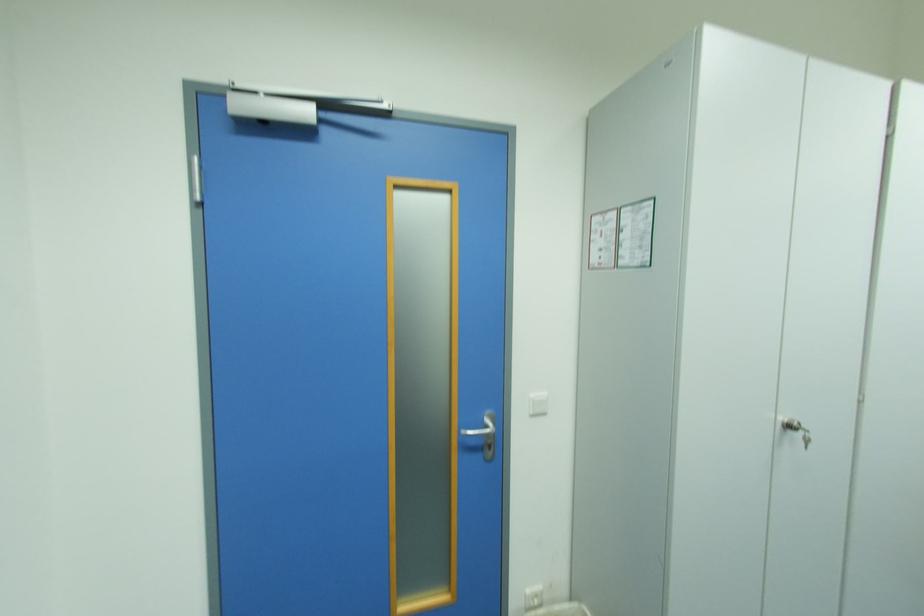
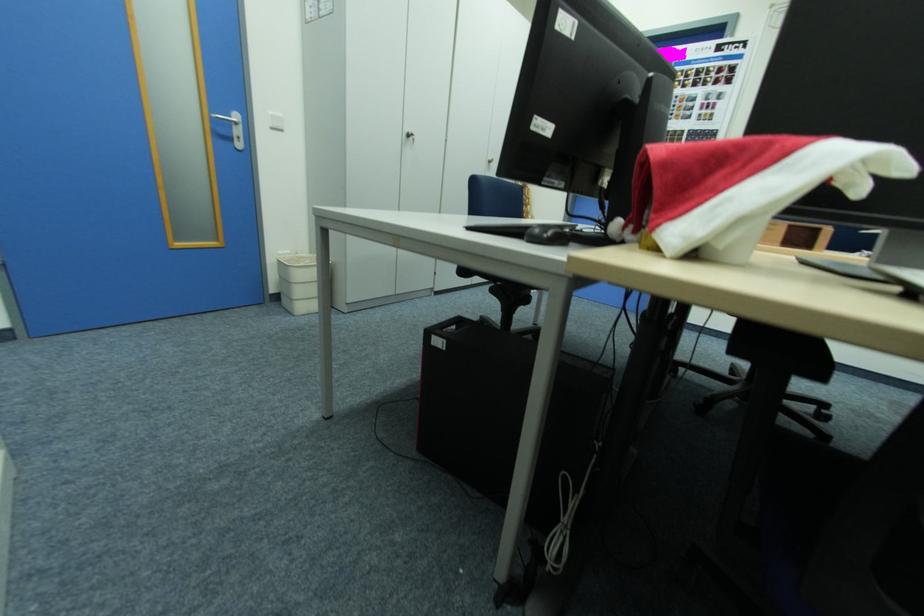
Find the pixel in the second image that matches the point at 540,395 in the first image.

(277, 114)